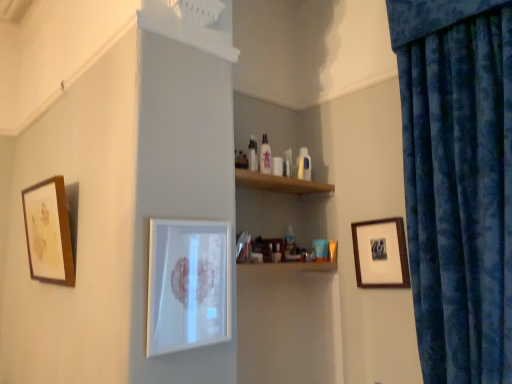
Question: Can you confirm if velvety blue curtain at right is smaller than white glossy picture frame at center, placed as the 2th picture frame when sorted from right to left?

Choices:
 (A) no
 (B) yes

Answer: (A)

Question: Can you confirm if velvety blue curtain at right is thinner than white glossy picture frame at center, the 2th picture frame from the left?

Choices:
 (A) yes
 (B) no

Answer: (B)

Question: Is velvety blue curtain at right touching white glossy picture frame at center, the 2th picture frame from the left?

Choices:
 (A) no
 (B) yes

Answer: (A)

Question: Does velvety blue curtain at right have a greater height compared to white glossy picture frame at center, placed as the 2th picture frame when sorted from right to left?

Choices:
 (A) no
 (B) yes

Answer: (B)

Question: Is velvety blue curtain at right positioned with its back to white glossy picture frame at center, placed as the 2th picture frame when sorted from right to left?

Choices:
 (A) no
 (B) yes

Answer: (A)

Question: From the image's perspective, is velvety blue curtain at right below white glossy picture frame at center, the 2th picture frame from the left?

Choices:
 (A) yes
 (B) no

Answer: (B)

Question: From a real-world perspective, is velvety blue curtain at right on wooden framed print at right, which is the 1th picture frame in right-to-left order?

Choices:
 (A) yes
 (B) no

Answer: (A)

Question: Is velvety blue curtain at right next to wooden framed print at right, which is the 1th picture frame in right-to-left order, and touching it?

Choices:
 (A) yes
 (B) no

Answer: (B)

Question: Does velvety blue curtain at right lie behind wooden framed print at right, the third picture frame in the left-to-right sequence?

Choices:
 (A) no
 (B) yes

Answer: (A)

Question: Considering the relative sizes of velvety blue curtain at right and wooden framed print at right, the third picture frame in the left-to-right sequence, in the image provided, is velvety blue curtain at right taller than wooden framed print at right, the third picture frame in the left-to-right sequence,?

Choices:
 (A) yes
 (B) no

Answer: (A)

Question: From a real-world perspective, is velvety blue curtain at right positioned under wooden framed print at right, the third picture frame in the left-to-right sequence, based on gravity?

Choices:
 (A) yes
 (B) no

Answer: (B)

Question: Are velvety blue curtain at right and wooden framed print at right, the third picture frame in the left-to-right sequence, located far from each other?

Choices:
 (A) yes
 (B) no

Answer: (B)

Question: Is wooden framed artwork at left, positioned as the 3th picture frame in right-to-left order, behind wooden framed print at right, the third picture frame in the left-to-right sequence?

Choices:
 (A) yes
 (B) no

Answer: (B)